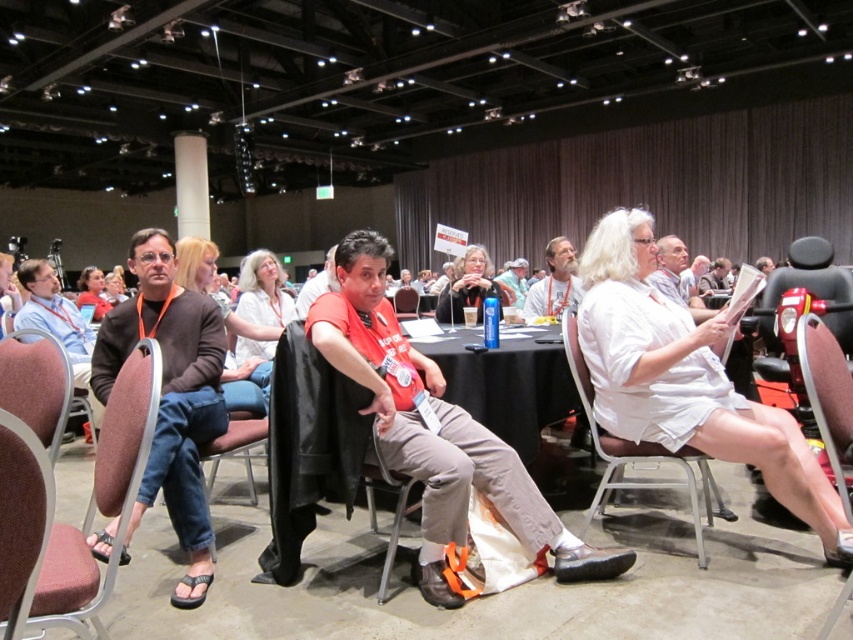
You are an event planner arranging seating for a group of guests with varying heights. You have two chairs available in the scene, the brown fabric chair at left and the brown fabric chair at center. Which chair would you choose for a taller guest to ensure comfort?

The brown fabric chair at left is much taller than the brown fabric chair at center, so it would be more suitable for a taller guest to ensure comfort.

You are a photographer at the event and need to capture a clear photo of the bearded man at center without the white plastic cup at center blocking his face. Based on their sizes, can you position the camera so that the cup is entirely out of the frame while keeping the man centered?

The bearded man at center is larger than the white plastic cup at center, so yes, you can position the camera to keep the man centered while ensuring the cup is out of the frame since the man is bigger and the cup can be framed around him without obstruction.